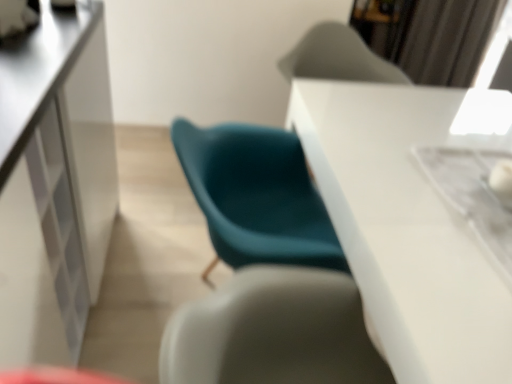
Describe the element at coordinates (54, 183) in the screenshot. The height and width of the screenshot is (384, 512). I see `white glossy cabinet at left` at that location.

Find the location of a particular element. This screenshot has width=512, height=384. white glossy cabinet at left is located at coordinates (54, 183).

Identify the location of white glossy cabinet at left. (54, 183).